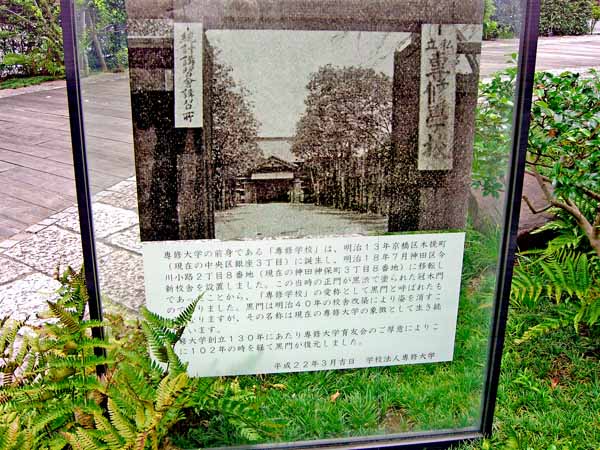
The image size is (600, 450). I want to click on black frame, so click(502, 289).